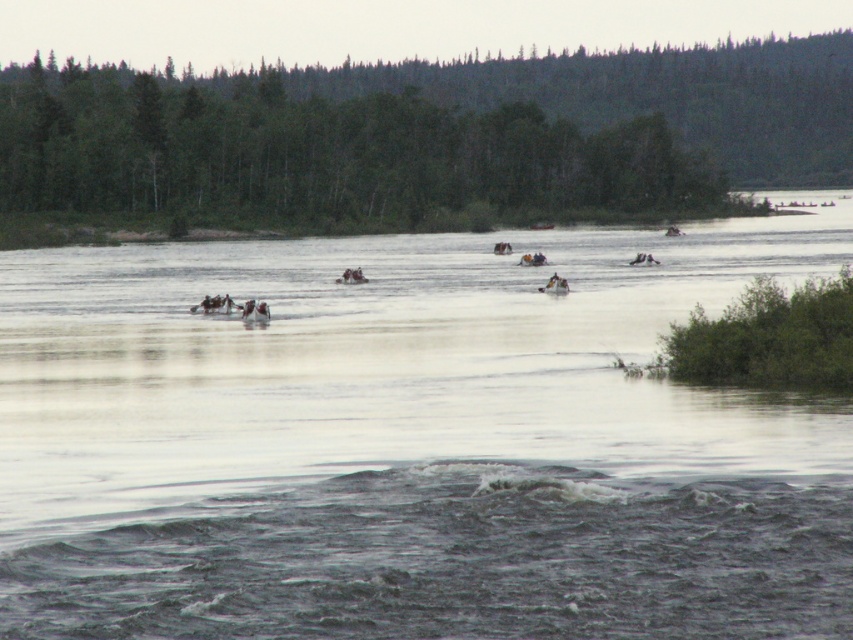
Question: Does clear water at center have a smaller size compared to white plastic raft at center?

Choices:
 (A) yes
 (B) no

Answer: (B)

Question: Which point is closer to the camera?

Choices:
 (A) (194, 161)
 (B) (271, 452)
 (C) (531, 262)

Answer: (B)

Question: Does clear water at center have a smaller size compared to green leafy trees at upper center?

Choices:
 (A) no
 (B) yes

Answer: (B)

Question: Which object appears farthest from the camera in this image?

Choices:
 (A) green leafy trees at upper center
 (B) white plastic raft at center
 (C) clear water at center

Answer: (A)

Question: Does green leafy trees at upper center come behind white plastic raft at center?

Choices:
 (A) yes
 (B) no

Answer: (A)

Question: Based on their relative distances, which object is nearer to the green leafy trees at upper center?

Choices:
 (A) clear water at center
 (B) white plastic raft at center

Answer: (A)